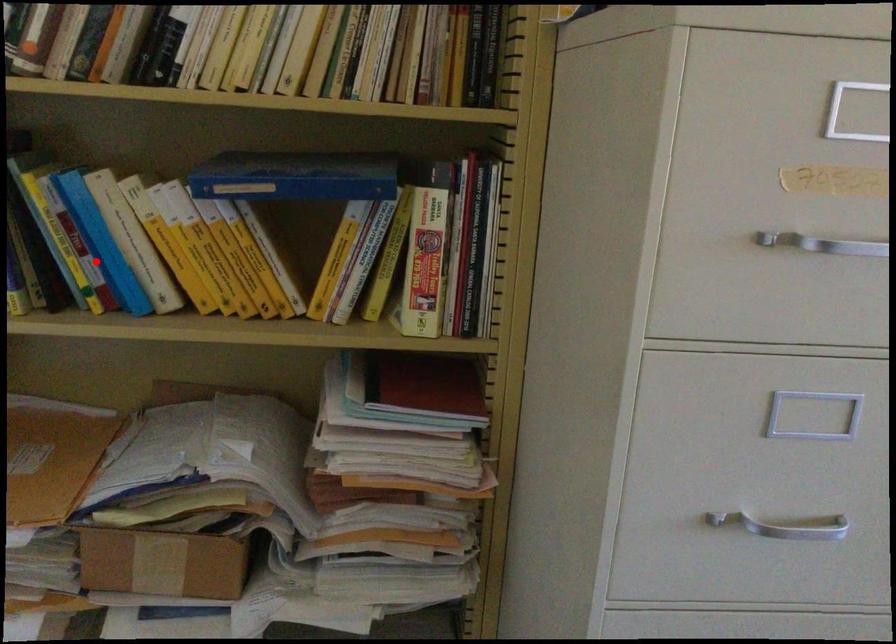
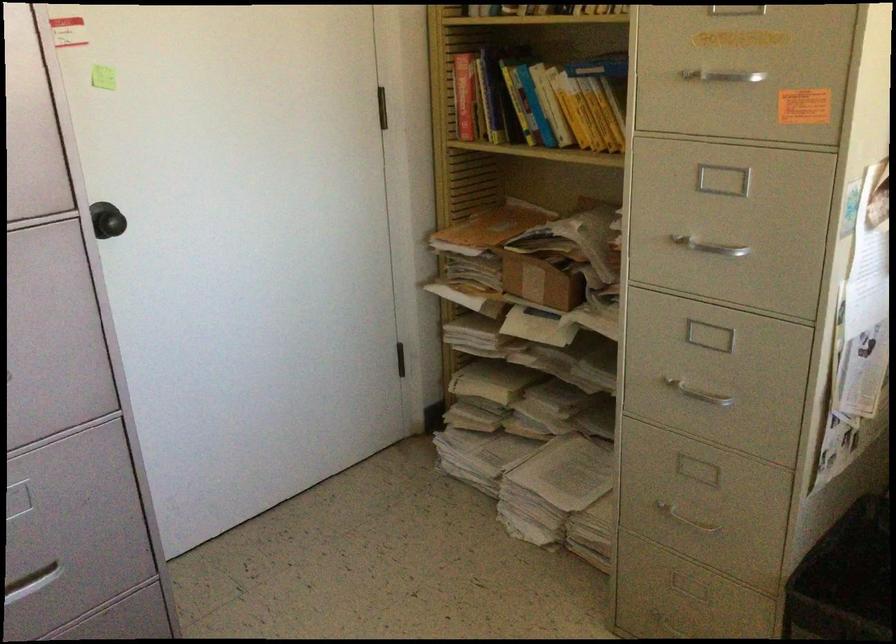
In the second image, find the point that corresponds to the highlighted location in the first image.

(523, 111)